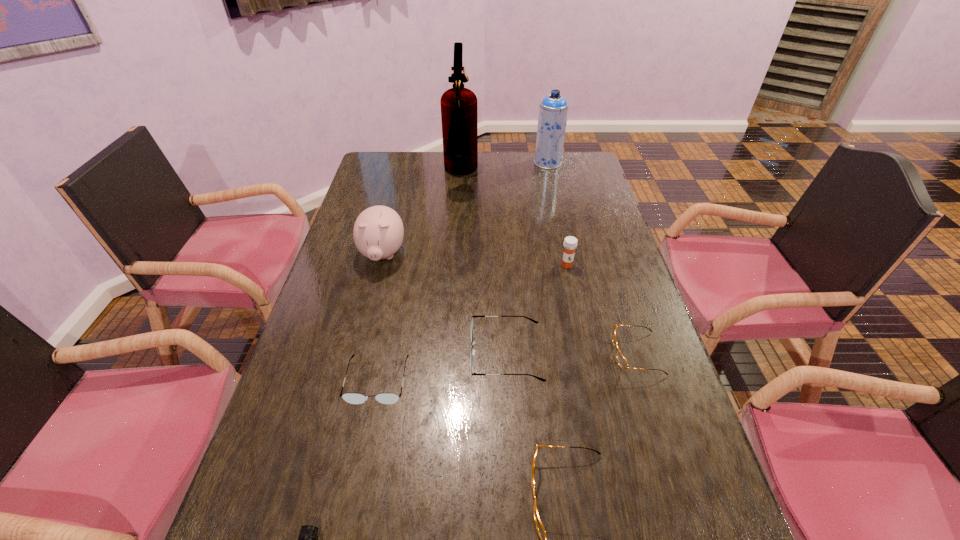
The height and width of the screenshot is (540, 960). What are the coordinates of `free region at the right edge` in the screenshot? It's located at (579, 246).

This screenshot has height=540, width=960. Find the location of `vacant point located between the aerosol can and the right black spectacles`. vacant point located between the aerosol can and the right black spectacles is located at coordinates (527, 259).

Where is `empty space that is in between the farther gold spectacles and the bigger black spectacles`? The height and width of the screenshot is (540, 960). empty space that is in between the farther gold spectacles and the bigger black spectacles is located at coordinates (571, 354).

Locate an element on the screen. free space between the seventh shortest object and the blue aerosol can is located at coordinates (465, 209).

At what (x,y) coordinates should I click in order to perform the action: click on free space that is in between the blue aerosol can and the rightmost object. Please return your answer as a coordinate pair (x, y). The image size is (960, 540). Looking at the image, I should click on (592, 258).

At what (x,y) coordinates should I click in order to perform the action: click on vacant area between the sixth shortest object and the red fire extinguisher. Please return your answer as a coordinate pair (x, y). The width and height of the screenshot is (960, 540). Looking at the image, I should click on (514, 220).

Where is `empty space between the seventh shortest object and the blue aerosol can`? empty space between the seventh shortest object and the blue aerosol can is located at coordinates (465, 209).

Where is `the seventh closest object to the aerosol can`? This screenshot has width=960, height=540. the seventh closest object to the aerosol can is located at coordinates (540, 528).

Identify which object is located as the sixth nearest to the red fire extinguisher. Please provide its 2D coordinates. Your answer should be formatted as a tuple, i.e. [(x, y)], where the tuple contains the x and y coordinates of a point satisfying the conditions above.

[(622, 361)]

Point out which spectacles is positioned as the second nearest to the eighth shortest object. Please provide its 2D coordinates. Your answer should be formatted as a tuple, i.e. [(x, y)], where the tuple contains the x and y coordinates of a point satisfying the conditions above.

[(622, 361)]